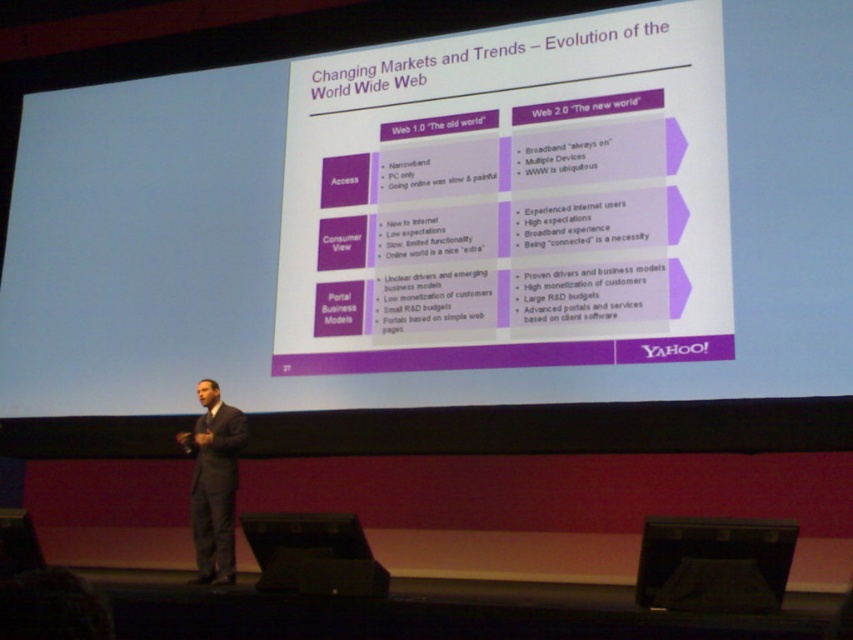
In the scene shown: Is white matte projection screen at upper center wider than dark gray suit at center?

In fact, white matte projection screen at upper center might be narrower than dark gray suit at center.

Is point (640, 349) positioned after point (194, 429)?

No, it is in front of (194, 429).

The image size is (853, 640). What do you see at coordinates (425, 225) in the screenshot?
I see `white matte projection screen at upper center` at bounding box center [425, 225].

Identify the location of white matte projection screen at upper center. (425, 225).

Is the position of white matte projection screen at upper center more distant than that of black plastic speaker at lower center?

Yes, white matte projection screen at upper center is behind black plastic speaker at lower center.

Does white matte projection screen at upper center have a greater height compared to black plastic speaker at lower center?

In fact, white matte projection screen at upper center may be shorter than black plastic speaker at lower center.

Between point (144, 131) and point (300, 577), which one is positioned in front?

Point (300, 577) is in front.

Identify the location of white matte projection screen at upper center. Image resolution: width=853 pixels, height=640 pixels. (425, 225).

Is point (296, 572) less distant than point (212, 492)?

Yes, point (296, 572) is closer to viewer.

Can you confirm if black plastic speaker at lower center is wider than dark gray suit at center?

Correct, the width of black plastic speaker at lower center exceeds that of dark gray suit at center.

What do you see at coordinates (312, 554) in the screenshot? I see `black plastic speaker at lower center` at bounding box center [312, 554].

Image resolution: width=853 pixels, height=640 pixels. In order to click on black plastic speaker at lower center in this screenshot , I will do `click(312, 554)`.